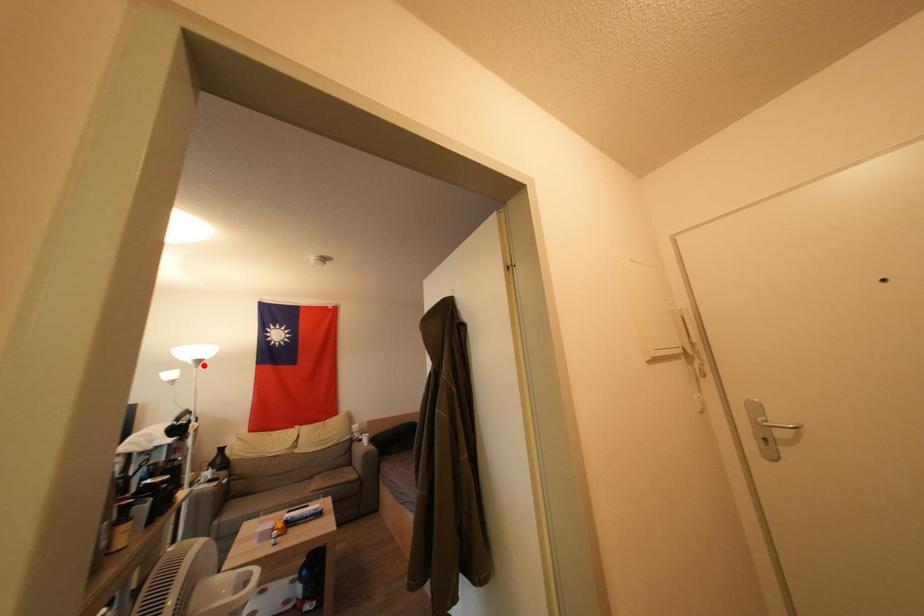
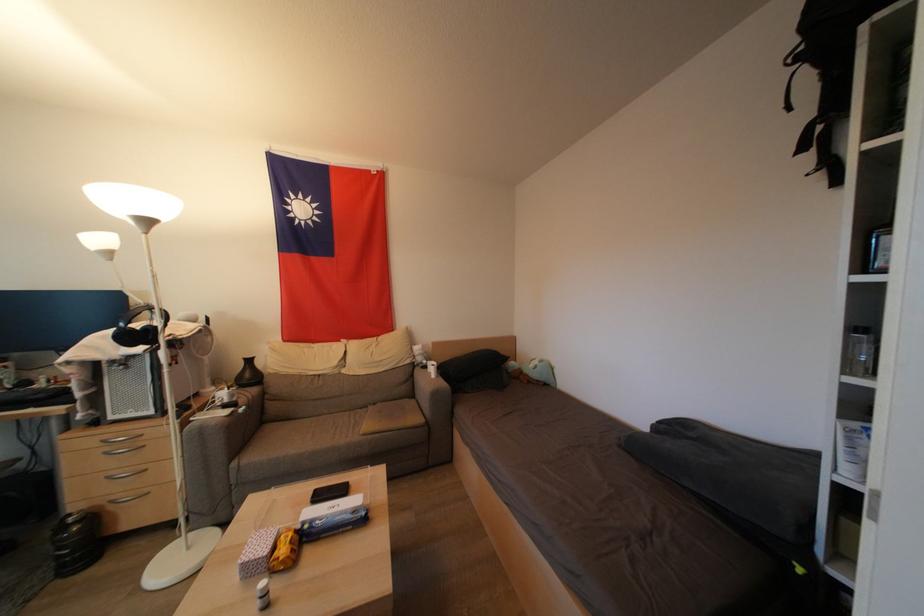
Where in the second image is the point corresponding to the highlighted location from the first image?

(152, 225)